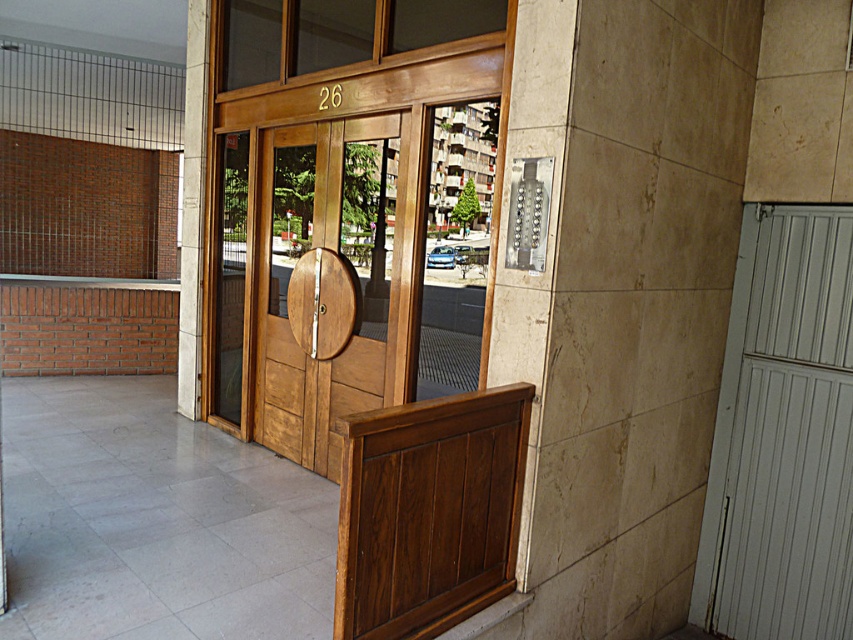
You are a delivery person trying to locate apartment 26. You see a transparent wood door at center and a smooth concrete pillar at left. Which object is closer to the apartment number displayed above the door?

The transparent wood door at center is closer to the apartment number displayed above the door because it is to the right of the smooth concrete pillar at left, meaning the pillar is further to the left and the door is positioned centrally, closer to the center where the apartment number is located.

Based on the photo, you are a delivery person trying to deliver a package to apartment 26. You see the transparent wood door at center and the smooth concrete pillar at left. Which object is larger in size?

The transparent wood door at center is bigger than the smooth concrete pillar at left, so the transparent wood door at center is larger in size.